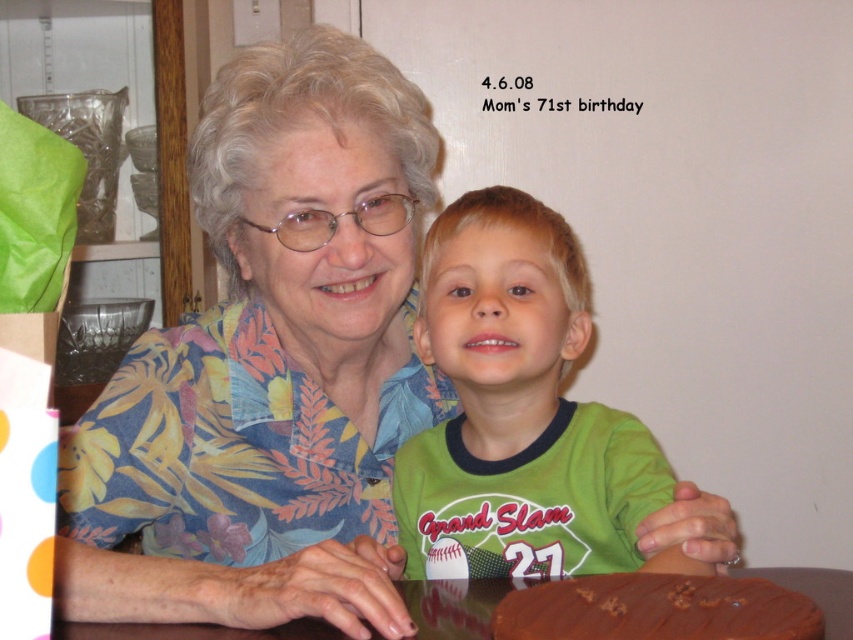
You are planning to place a birthday gift on the table. The gift is 10 cm in width. Can the brown glossy table at lower center accommodate the chocolate matte cake at lower center along with the gift?

The chocolate matte cake at lower center has a smaller size compared to the brown glossy table at lower center. Since the cake and gift together are 10 cm plus the cake size, which is smaller than the table, there should be enough space. Yes, the table can accommodate both items.